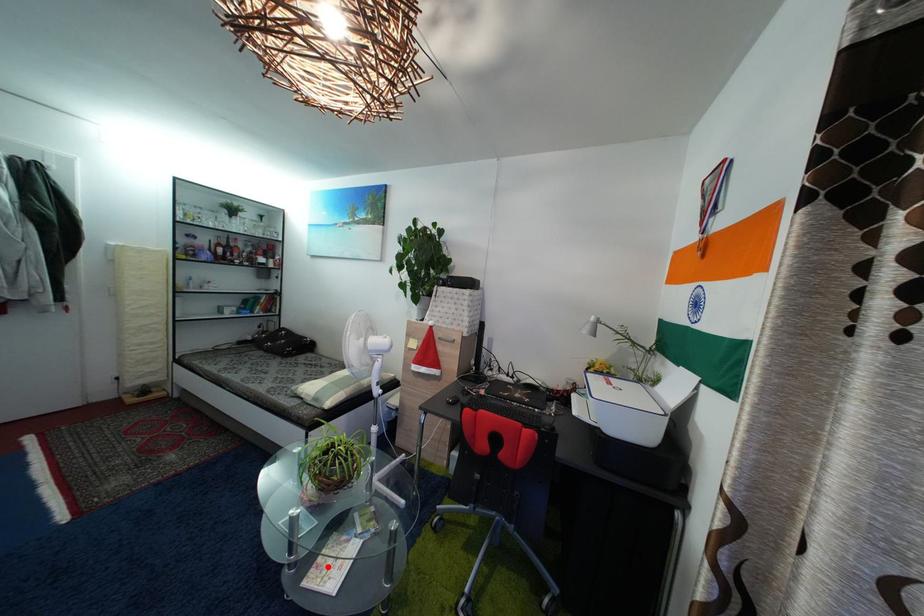
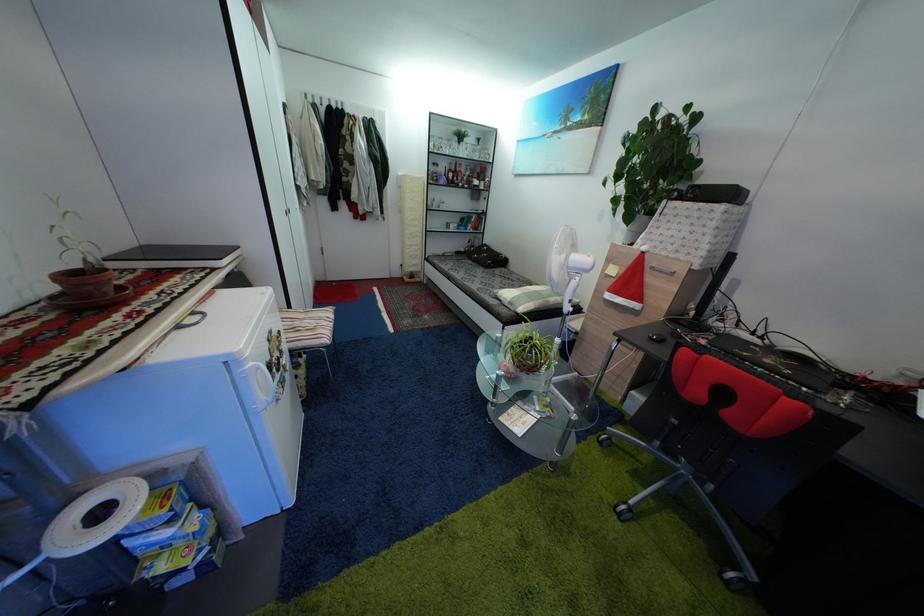
Where in the second image is the point corresponding to the highlighted location from the first image?

(517, 418)